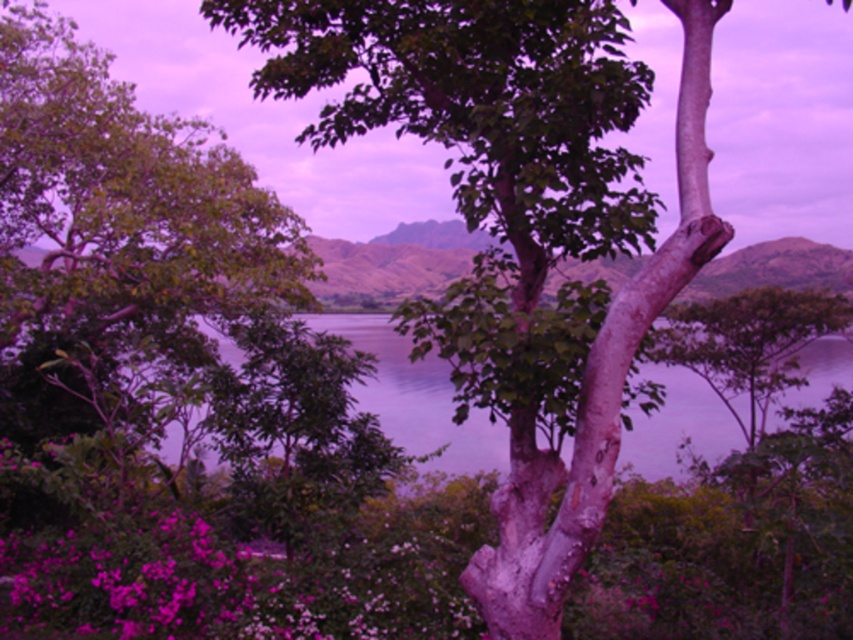
You are an artist planning to paint this scene. You want to ensure the pink matte flowers at lower left and the smooth bark tree at center are proportionally accurate. Which object should you paint first if you follow the rule of starting with larger objects?

The smooth bark tree at center should be painted first because it is larger than the pink matte flowers at lower left.

You are a gardener who wants to plant a new flower bed near the pink matte flowers at lower left and the smooth bark tree at center. Based on their current positions, which object is closer to the ground?

The pink matte flowers at lower left are closer to the ground since they are positioned under the smooth bark tree at center.